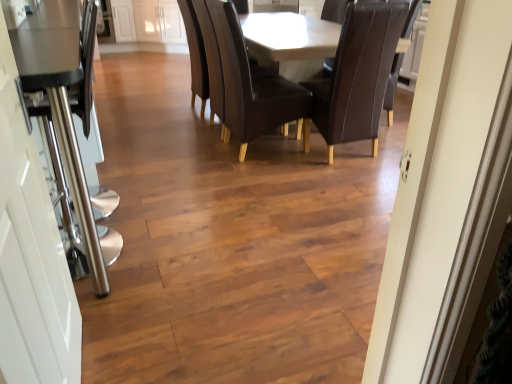
Question: Is matte brown table at center not inside brown leather chair at center, which is the 2th chair from right to left?

Choices:
 (A) no
 (B) yes

Answer: (B)

Question: Is matte brown table at center oriented away from brown leather chair at center, which is the 2th chair from right to left?

Choices:
 (A) no
 (B) yes

Answer: (A)

Question: From the image's perspective, does matte brown table at center appear higher than brown leather chair at center, acting as the first chair starting from the left?

Choices:
 (A) no
 (B) yes

Answer: (B)

Question: Is matte brown table at center bigger than brown leather chair at center, which is the 2th chair from right to left?

Choices:
 (A) yes
 (B) no

Answer: (A)

Question: From a real-world perspective, is matte brown table at center beneath brown leather chair at center, which is the 2th chair from right to left?

Choices:
 (A) no
 (B) yes

Answer: (B)

Question: Is matte brown table at center oriented towards brown leather chair at center, which is the 2th chair from right to left?

Choices:
 (A) no
 (B) yes

Answer: (B)

Question: Is brown leather chair at center, the 1th chair from the right, positioned with its back to brown leather chair at center, acting as the first chair starting from the left?

Choices:
 (A) no
 (B) yes

Answer: (A)

Question: Considering the relative sizes of brown leather chair at center, the 2th chair when ordered from left to right, and brown leather chair at center, which is the 2th chair from right to left, in the image provided, is brown leather chair at center, the 2th chair when ordered from left to right, wider than brown leather chair at center, which is the 2th chair from right to left,?

Choices:
 (A) yes
 (B) no

Answer: (B)

Question: From the image's perspective, would you say brown leather chair at center, the 1th chair from the right, is shown under brown leather chair at center, which is the 2th chair from right to left?

Choices:
 (A) no
 (B) yes

Answer: (B)

Question: Is brown leather chair at center, the 2th chair when ordered from left to right, positioned in front of brown leather chair at center, acting as the first chair starting from the left?

Choices:
 (A) yes
 (B) no

Answer: (A)

Question: Can you confirm if brown leather chair at center, the 2th chair when ordered from left to right, is thinner than brown leather chair at center, which is the 2th chair from right to left?

Choices:
 (A) no
 (B) yes

Answer: (B)

Question: Is brown leather chair at center, the 1th chair from the right, taller than brown leather chair at center, acting as the first chair starting from the left?

Choices:
 (A) yes
 (B) no

Answer: (B)

Question: From a real-world perspective, is brown leather chair at center, which is the 2th chair from right to left, on top of matte brown table at center?

Choices:
 (A) no
 (B) yes

Answer: (B)